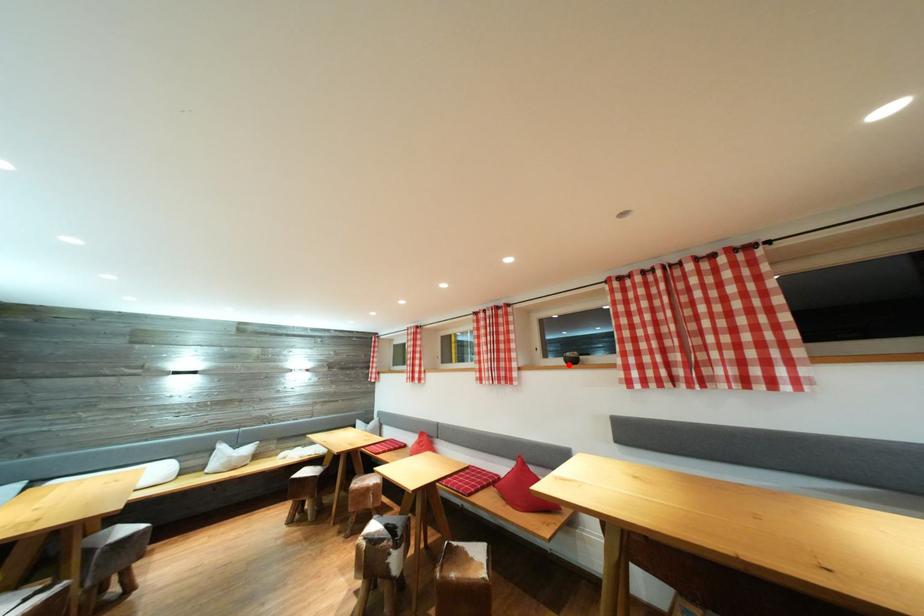
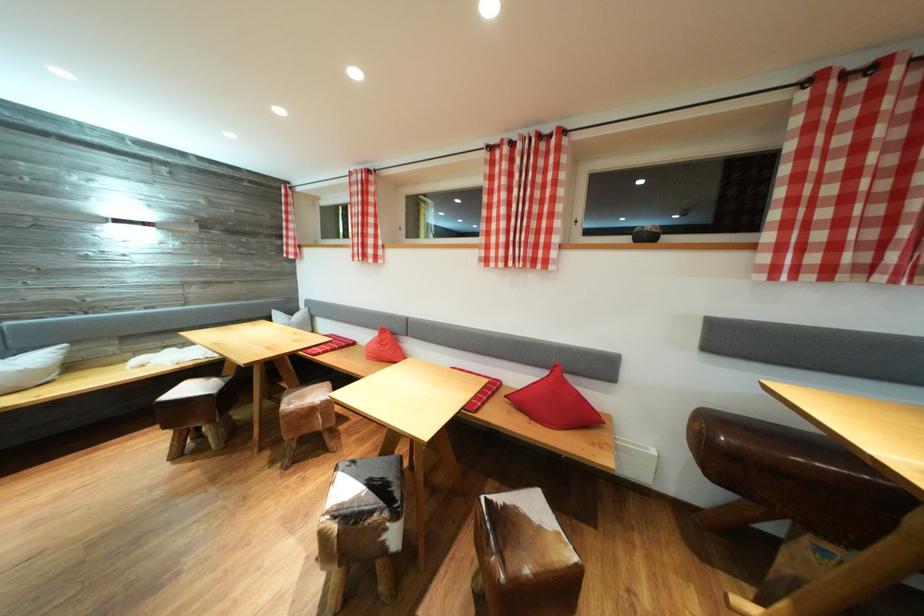
The point at the highlighted location is marked in the first image. Where is the corresponding point in the second image?

(638, 241)